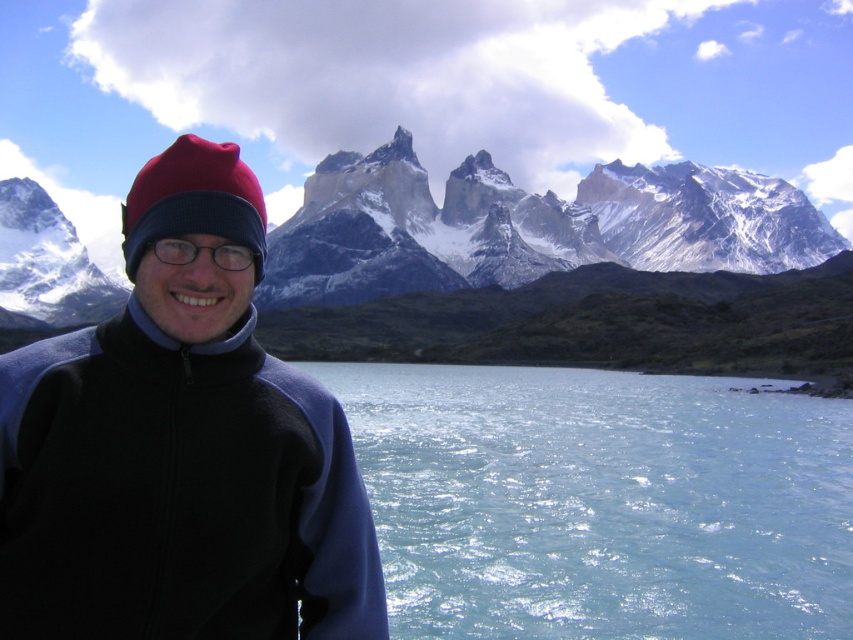
Between clear water at lower center and red woolen beanie at left, which one has more height?

clear water at lower center

Does clear water at lower center lie in front of red woolen beanie at left?

No, it is behind red woolen beanie at left.

Where is `clear water at lower center`? Image resolution: width=853 pixels, height=640 pixels. clear water at lower center is located at coordinates (601, 502).

Where is `clear water at lower center`? clear water at lower center is located at coordinates (601, 502).

Does matte fleece jacket at center appear on the left side of clear water at lower center?

Correct, you'll find matte fleece jacket at center to the left of clear water at lower center.

Describe the element at coordinates (180, 448) in the screenshot. This screenshot has height=640, width=853. I see `matte fleece jacket at center` at that location.

You are a GUI agent. You are given a task and a screenshot of the screen. Output one action in this format:
    pyautogui.click(x=<x>, y=<y>)
    Task: Click on the matte fleece jacket at center
    Image resolution: width=853 pixels, height=640 pixels.
    Given the screenshot: What is the action you would take?
    pyautogui.click(x=180, y=448)

You are a GUI agent. You are given a task and a screenshot of the screen. Output one action in this format:
    pyautogui.click(x=<x>, y=<y>)
    Task: Click on the snowy granite mountain range at upper center
    
    Given the screenshot: What is the action you would take?
    pyautogui.click(x=548, y=268)